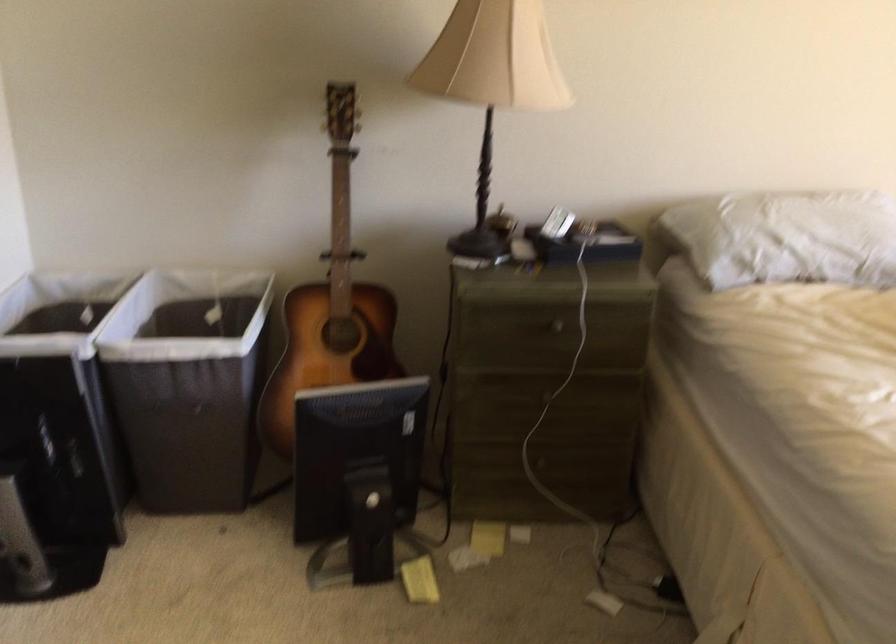
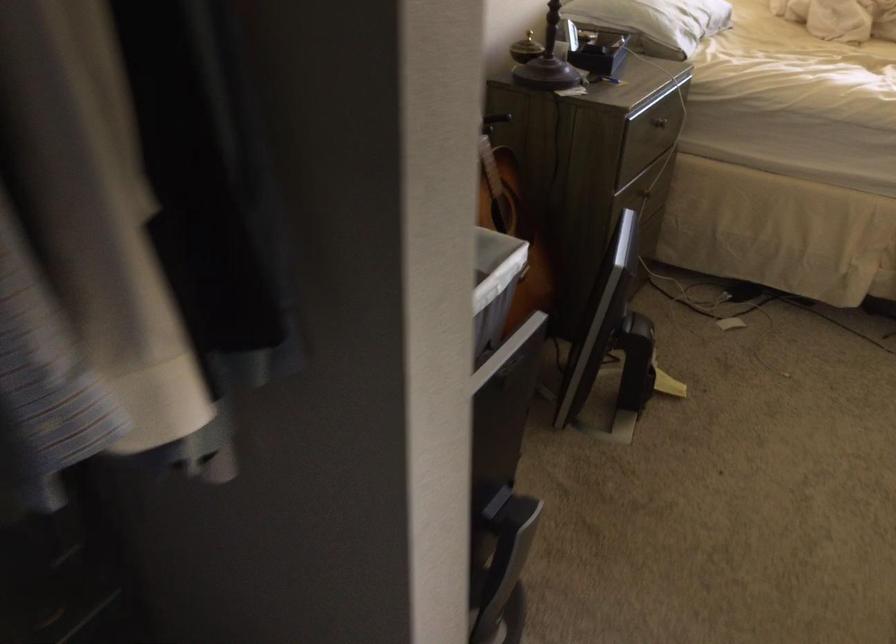
The point at (373,351) is marked in the first image. Where is the corresponding point in the second image?

(513, 227)